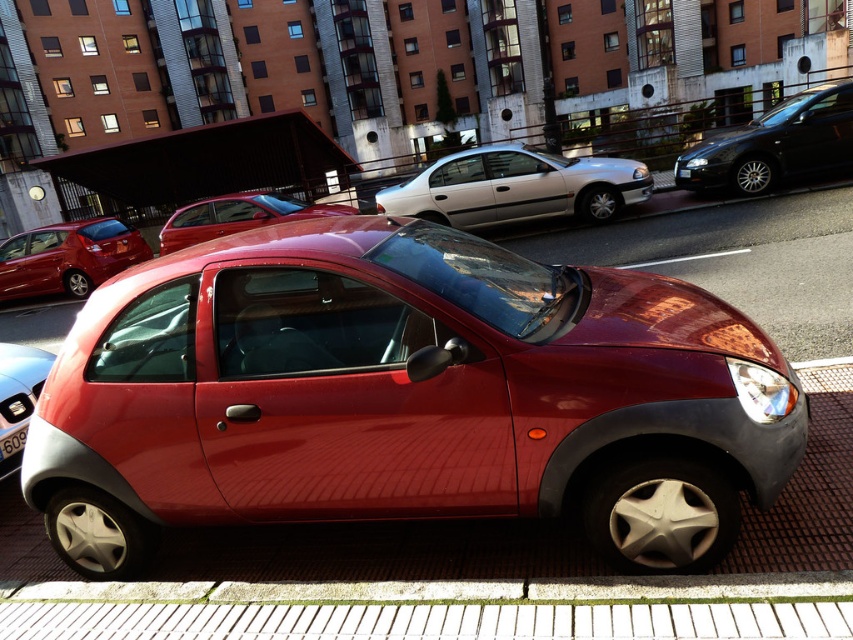
Question: Which of the following is the closest to the observer?

Choices:
 (A) (509, 195)
 (B) (235, 193)
 (C) (18, 436)

Answer: (C)

Question: Which is farther from the shiny red car at center?

Choices:
 (A) shiny silver car at lower left
 (B) black plastic license plate at center
 (C) glossy black sedan at upper right

Answer: (C)

Question: Does shiny red car at center appear under black plastic license plate at center?

Choices:
 (A) no
 (B) yes

Answer: (A)

Question: Which object is positioned closest to the white glossy sedan at center?

Choices:
 (A) black plastic license plate at center
 (B) shiny silver car at lower left

Answer: (B)

Question: Does white glossy sedan at center appear on the left side of glossy red car at center?

Choices:
 (A) no
 (B) yes

Answer: (A)

Question: Is shiny red car at center to the left of glossy red car at center from the viewer's perspective?

Choices:
 (A) no
 (B) yes

Answer: (A)